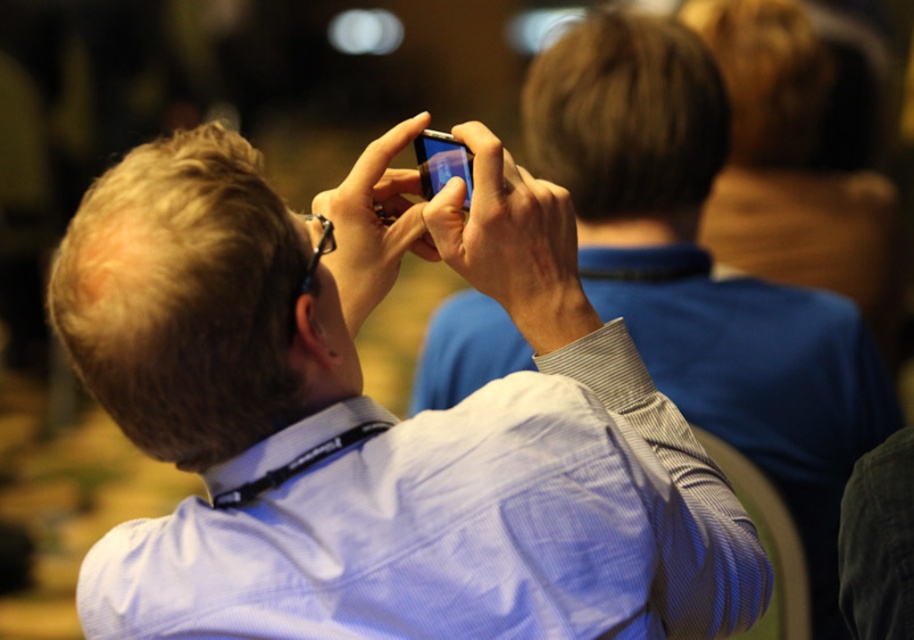
You are a photographer trying to capture a clear photo of the matte blue shirt at center and the matte black smartphone at center. Which object should you focus on to ensure it appears sharp in the photo?

The matte blue shirt at center is positioned under the matte black smartphone at center, so focusing on the matte black smartphone at center will ensure it is sharp, while the matte blue shirt at center may appear slightly out of focus due to its position behind the smartphone.

You are organizing a tech conference and need to place two devices on a table. The matte black phone at upper center and the matte black smartphone at center must be arranged such that the phone is to the right of the smartphone. Is this possible based on their current positions?

The matte black phone at upper center is currently to the left of the matte black smartphone at center. To place the phone to the right of the smartphone, you would need to swap their positions, which is possible as long as there is enough space on the table.